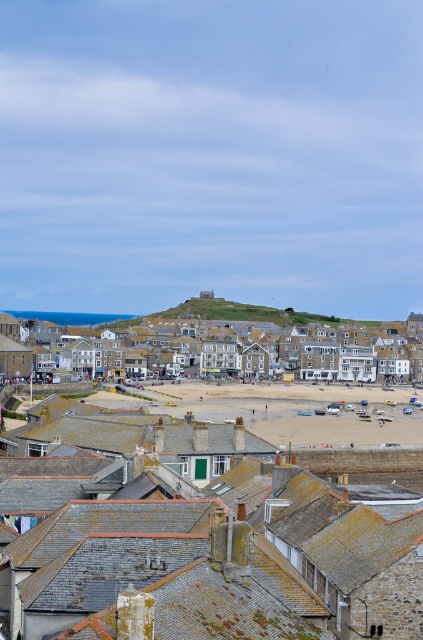
Question: Is beige sand at center to the right of smooth stone hillside at center from the viewer's perspective?

Choices:
 (A) yes
 (B) no

Answer: (A)

Question: Can you confirm if beige sand at center is positioned to the left of beige stone buildings at center?

Choices:
 (A) yes
 (B) no

Answer: (B)

Question: Among these points, which one is nearest to the camera?

Choices:
 (A) (197, 308)
 (B) (288, 424)
 (C) (398, 380)

Answer: (B)

Question: Which object appears closest to the camera in this image?

Choices:
 (A) smooth stone hillside at center
 (B) beige stone buildings at center

Answer: (B)

Question: Is beige stone buildings at center smaller than smooth stone hillside at center?

Choices:
 (A) yes
 (B) no

Answer: (B)

Question: Which point is farther from the camera taking this photo?

Choices:
 (A) (249, 410)
 (B) (213, 305)

Answer: (B)